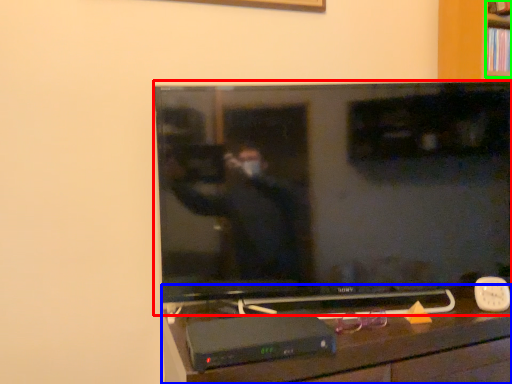
Question: Based on their relative distances, which object is farther from television (highlighted by a red box)? Choose from furniture (highlighted by a blue box) and shelf (highlighted by a green box).

Choices:
 (A) furniture
 (B) shelf

Answer: (B)